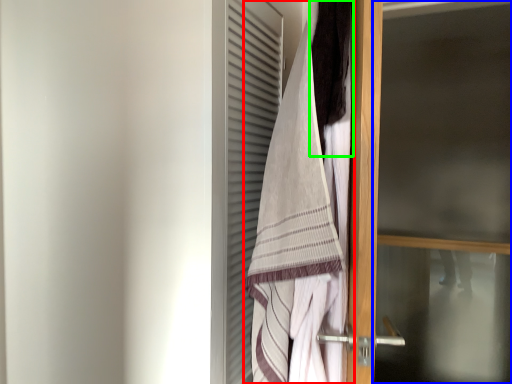
Question: Based on their relative distances, which object is farther from towel (highlighted by a red box)? Choose from screen door (highlighted by a blue box) and hair (highlighted by a green box).

Choices:
 (A) screen door
 (B) hair

Answer: (A)